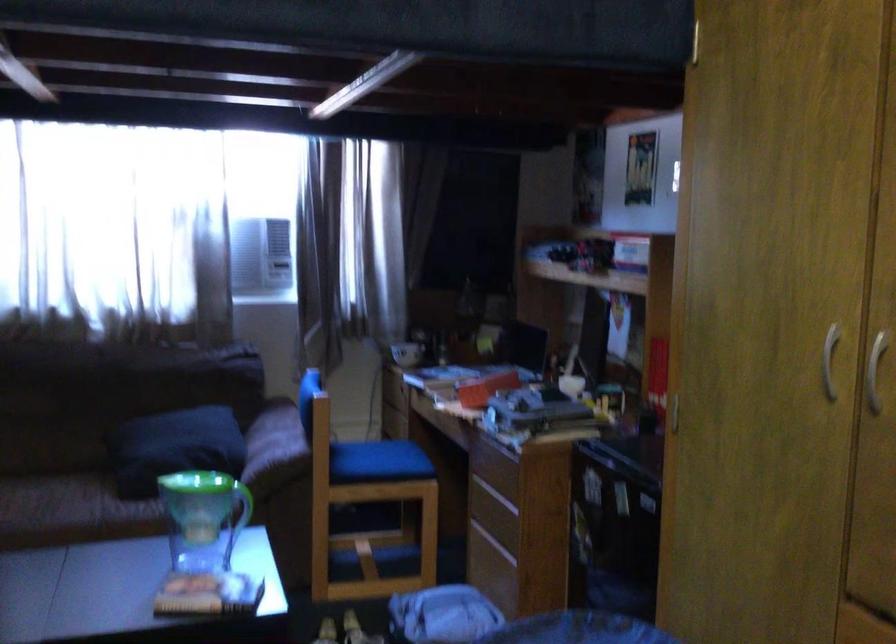
Describe the element at coordinates (377, 462) in the screenshot. The width and height of the screenshot is (896, 644). I see `the blue chair sitting surface` at that location.